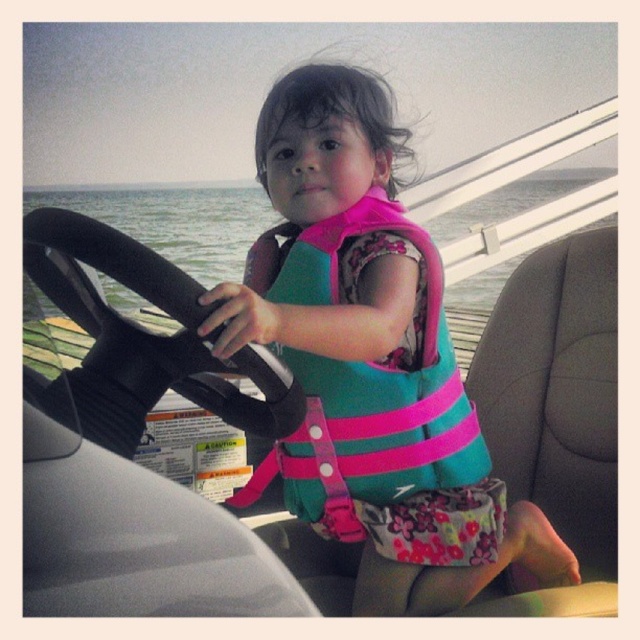
Is the position of teal fabric life vest at center more distant than that of teal/pink fabric life jacket at center?

No, it is in front of teal/pink fabric life jacket at center.

Between teal fabric life vest at center and teal/pink fabric life jacket at center, which one appears on the left side from the viewer's perspective?

teal/pink fabric life jacket at center is more to the left.

Between point (337, 275) and point (388, 221), which one is positioned in front?

Point (388, 221)

The width and height of the screenshot is (640, 640). What are the coordinates of `teal fabric life vest at center` in the screenshot? It's located at (371, 362).